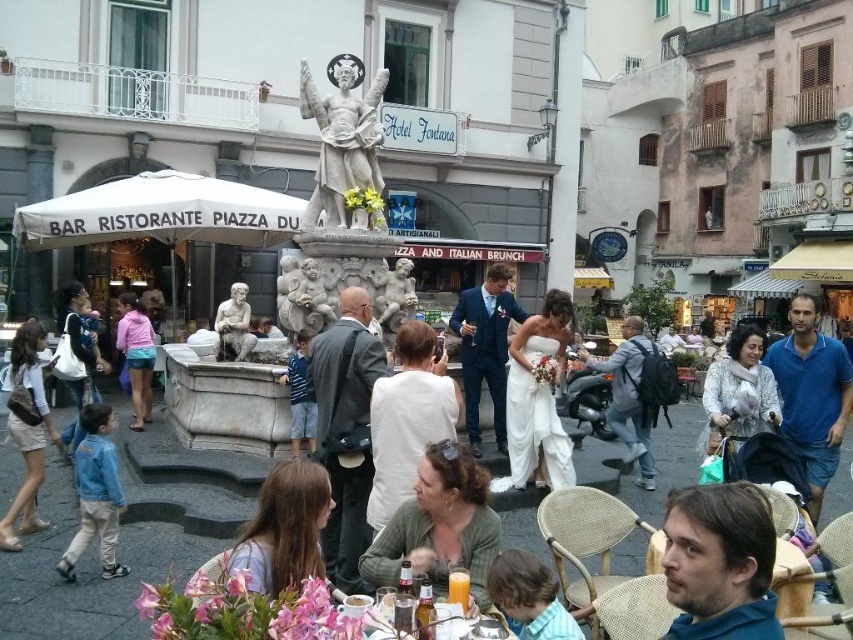
Question: Can you confirm if white satin dress at center is positioned above gray fabric jacket at center?

Choices:
 (A) yes
 (B) no

Answer: (A)

Question: Among these objects, which one is nearest to the camera?

Choices:
 (A) striped shirt at center
 (B) green textured sweater at center
 (C) light brown hair at lower center

Answer: (C)

Question: Estimate the real-world distances between objects in this image. Which object is farther from the denim jacket at left?

Choices:
 (A) striped shirt at center
 (B) brown hair at lower right
 (C) smooth marble cherub at center

Answer: (B)

Question: Can you confirm if blue cotton shirt at center is positioned to the left of light brown hair at center?

Choices:
 (A) yes
 (B) no

Answer: (B)

Question: Can you confirm if pink fabric shorts at left is smaller than marble statue at center?

Choices:
 (A) yes
 (B) no

Answer: (B)

Question: Which point is closer to the camera?

Choices:
 (A) (490, 317)
 (B) (627, 376)

Answer: (B)